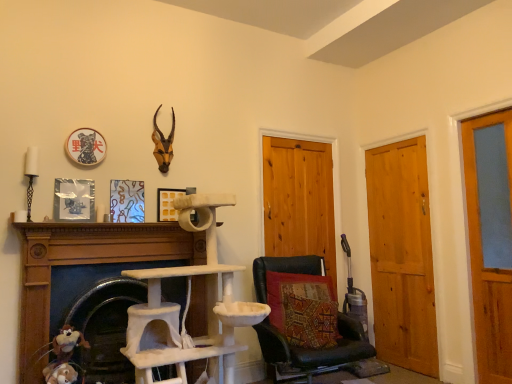
Where is `vacant space in front of yellow matte picture frame at center, marked as the 2th picture frame in a left-to-right arrangement`? vacant space in front of yellow matte picture frame at center, marked as the 2th picture frame in a left-to-right arrangement is located at coordinates (165, 228).